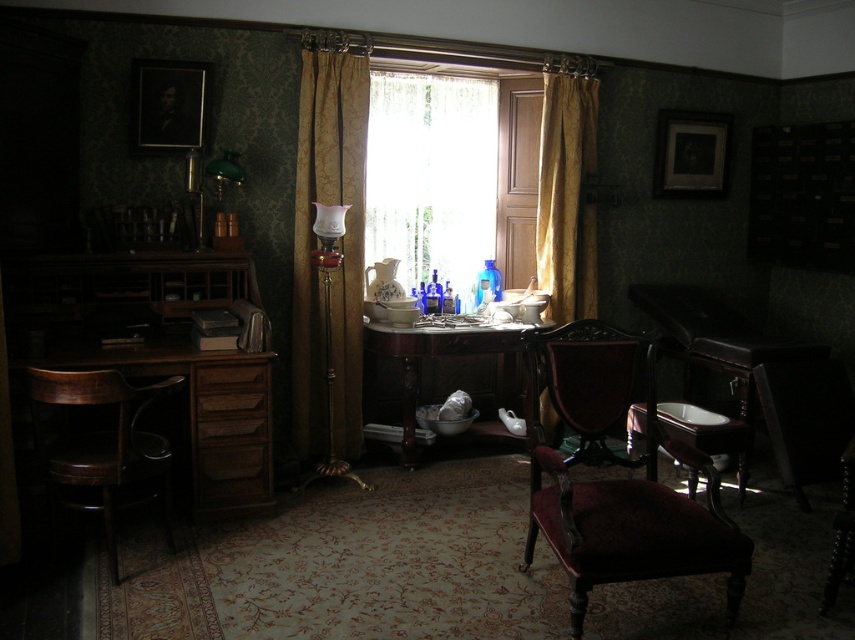
Is velvet burgundy armchair at center behind gold velvet curtain at center?

No, it is in front of gold velvet curtain at center.

Who is more forward, (653, 506) or (570, 104)?

Point (653, 506) is more forward.

Locate an element on the screen. The width and height of the screenshot is (855, 640). velvet burgundy armchair at center is located at coordinates (616, 480).

The width and height of the screenshot is (855, 640). I want to click on velvet burgundy armchair at center, so coord(616,480).

Is wooden drawer at lower left positioned in front of matte black toilet at lower right?

Yes.

Does wooden drawer at lower left have a lesser height compared to matte black toilet at lower right?

Yes.

Describe the element at coordinates (230, 435) in the screenshot. I see `wooden drawer at lower left` at that location.

Locate an element on the screen. wooden drawer at lower left is located at coordinates (230, 435).

Who is more forward, (57, 468) or (221, 403)?

Positioned in front is point (57, 468).

Between point (143, 390) and point (237, 413), which one is positioned in front?

Positioned in front is point (143, 390).

Image resolution: width=855 pixels, height=640 pixels. Find the location of `wooden armchair at left`. wooden armchair at left is located at coordinates (101, 444).